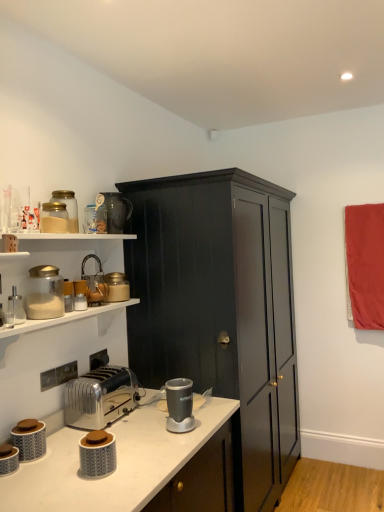
What do you see at coordinates (220, 309) in the screenshot? The width and height of the screenshot is (384, 512). I see `dark wood cabinet at center` at bounding box center [220, 309].

How much space does matte gray jar at lower left, arranged as the ninth appliance when viewed from the top, occupy vertically?

5.60 inches.

You are a GUI agent. You are given a task and a screenshot of the screen. Output one action in this format:
    pyautogui.click(x=<x>, y=<y>)
    Task: Click on the matte gray jar at lower left, arranged as the ninth appliance when viewed from the top
    
    Given the screenshot: What is the action you would take?
    pyautogui.click(x=98, y=457)

Describe the element at coordinates (68, 296) in the screenshot. I see `metallic silver toaster at upper left, arranged as the 6th appliance when viewed from the top` at that location.

Identify the location of clear glass salt shaker at left, positioned as the 5th appliance in bottom-to-top order. (17, 306).

Identify the location of dark wood cabinet at center. This screenshot has width=384, height=512. (220, 309).

From a real-world perspective, is metallic gray blender at center, the fourth appliance when ordered from bottom to top, on matte glass jar at upper left, the 1th appliance positioned from the top?

No, from a real-world perspective, metallic gray blender at center, the fourth appliance when ordered from bottom to top, is not over matte glass jar at upper left, the 1th appliance positioned from the top

Which object is positioned more to the left, metallic gray blender at center, which appears as the 8th appliance when viewed from the top, or matte glass jar at upper left, the 1th appliance positioned from the top?

From the viewer's perspective, matte glass jar at upper left, the 1th appliance positioned from the top, appears more on the left side.

Is metallic gray blender at center, which appears as the 8th appliance when viewed from the top, situated inside matte glass jar at upper left, the 1th appliance positioned from the top, or outside?

metallic gray blender at center, which appears as the 8th appliance when viewed from the top, is not inside matte glass jar at upper left, the 1th appliance positioned from the top, it's outside.

Is metallic gray blender at center, the fourth appliance when ordered from bottom to top, positioned with its back to matte glass jar at upper left, the 11th appliance ordered from the bottom?

metallic gray blender at center, the fourth appliance when ordered from bottom to top, does not have its back to matte glass jar at upper left, the 11th appliance ordered from the bottom.

Considering the relative sizes of matte gray canister at lower left, the 11th appliance when ordered from top to bottom, and matte glass jar at upper left, the eighth appliance from the bottom, in the image provided, is matte gray canister at lower left, the 11th appliance when ordered from top to bottom, shorter than matte glass jar at upper left, the eighth appliance from the bottom,?

Yes.

Are matte gray canister at lower left, the 11th appliance when ordered from top to bottom, and matte glass jar at upper left, the eighth appliance from the bottom, beside each other?

There is a gap between matte gray canister at lower left, the 11th appliance when ordered from top to bottom, and matte glass jar at upper left, the eighth appliance from the bottom.

Between matte gray canister at lower left, the 11th appliance when ordered from top to bottom, and matte glass jar at upper left, the eighth appliance from the bottom, which one has smaller size?

Smaller between the two is matte gray canister at lower left, the 11th appliance when ordered from top to bottom.

Does point (10, 461) appear closer or farther from the camera than point (28, 281)?

Clearly, point (10, 461) is closer to the camera than point (28, 281).

Is matte glass jar at upper left, the 11th appliance ordered from the bottom, at the back of matte glass jar at upper left, positioned as the second appliance in top-to-bottom order?

No, matte glass jar at upper left, positioned as the second appliance in top-to-bottom order, is not facing the opposite direction of matte glass jar at upper left, the 11th appliance ordered from the bottom.

Based on the photo, from a real-world perspective, who is located lower, matte glass jar at upper left, arranged as the tenth appliance when ordered from the bottom, or matte glass jar at upper left, the 1th appliance positioned from the top?

matte glass jar at upper left, arranged as the tenth appliance when ordered from the bottom, is physically lower.

Consider the image. Is matte glass jar at upper left, positioned as the second appliance in top-to-bottom order, in front of matte glass jar at upper left, the 1th appliance positioned from the top?

Yes, matte glass jar at upper left, positioned as the second appliance in top-to-bottom order, is closer to the camera.

Is matte gray jar at lower left, which is the 3th appliance from bottom to top, shorter than metallic silver toaster at upper left, arranged as the 6th appliance when viewed from the top?

Indeed, matte gray jar at lower left, which is the 3th appliance from bottom to top, has a lesser height compared to metallic silver toaster at upper left, arranged as the 6th appliance when viewed from the top.

From the picture: Is the position of matte gray jar at lower left, arranged as the ninth appliance when viewed from the top, more distant than that of metallic silver toaster at upper left, arranged as the sixth appliance when ordered from the bottom?

No, it is in front of metallic silver toaster at upper left, arranged as the sixth appliance when ordered from the bottom.

Is matte gray jar at lower left, which is the 3th appliance from bottom to top, facing towards metallic silver toaster at upper left, arranged as the sixth appliance when ordered from the bottom?

No, matte gray jar at lower left, which is the 3th appliance from bottom to top, is not facing towards metallic silver toaster at upper left, arranged as the sixth appliance when ordered from the bottom.

Would you say matte gray jar at lower left, arranged as the ninth appliance when viewed from the top, is to the left or to the right of metallic silver toaster at upper left, arranged as the 6th appliance when viewed from the top, in the picture?

Based on their positions, matte gray jar at lower left, arranged as the ninth appliance when viewed from the top, is located to the right of metallic silver toaster at upper left, arranged as the 6th appliance when viewed from the top.

Is metallic faucet at upper left, the third appliance viewed from the top, positioned beyond the bounds of dark wood cabinet at center?

Indeed, metallic faucet at upper left, the third appliance viewed from the top, is completely outside dark wood cabinet at center.

Could you measure the distance between metallic faucet at upper left, the third appliance viewed from the top, and dark wood cabinet at center?

The distance of metallic faucet at upper left, the third appliance viewed from the top, from dark wood cabinet at center is 28.31 inches.

In terms of width, does metallic faucet at upper left, the third appliance viewed from the top, look wider or thinner when compared to dark wood cabinet at center?

Clearly, metallic faucet at upper left, the third appliance viewed from the top, has less width compared to dark wood cabinet at center.

Is matte gray jar at lower left, which is the 3th appliance from bottom to top, to the left of matte glass jar at upper left, the 4th appliance from the top, from the viewer's perspective?

In fact, matte gray jar at lower left, which is the 3th appliance from bottom to top, is to the right of matte glass jar at upper left, the 4th appliance from the top.

Between matte gray jar at lower left, arranged as the ninth appliance when viewed from the top, and matte glass jar at upper left, the eighth appliance from the bottom, which one has more height?

With more height is matte glass jar at upper left, the eighth appliance from the bottom.

Considering the relative sizes of matte gray jar at lower left, arranged as the ninth appliance when viewed from the top, and matte glass jar at upper left, the eighth appliance from the bottom, in the image provided, is matte gray jar at lower left, arranged as the ninth appliance when viewed from the top, thinner than matte glass jar at upper left, the eighth appliance from the bottom,?

Correct, the width of matte gray jar at lower left, arranged as the ninth appliance when viewed from the top, is less than that of matte glass jar at upper left, the eighth appliance from the bottom.

Does clear glass salt shaker at left, the 7th appliance when ordered from top to bottom, have a lesser height compared to red fabric curtain at right?

Correct, clear glass salt shaker at left, the 7th appliance when ordered from top to bottom, is not as tall as red fabric curtain at right.

Looking at this image, can you confirm if clear glass salt shaker at left, positioned as the 5th appliance in bottom-to-top order, is positioned to the right of red fabric curtain at right?

No, clear glass salt shaker at left, positioned as the 5th appliance in bottom-to-top order, is not to the right of red fabric curtain at right.

Is clear glass salt shaker at left, the 7th appliance when ordered from top to bottom, oriented away from red fabric curtain at right?

clear glass salt shaker at left, the 7th appliance when ordered from top to bottom, is not turned away from red fabric curtain at right.

Between clear glass salt shaker at left, the 7th appliance when ordered from top to bottom, and red fabric curtain at right, which one is positioned behind?

red fabric curtain at right is further from the camera.

Where is `the 3rd appliance in front of the matte glass jar at upper left, the 11th appliance ordered from the bottom`? the 3rd appliance in front of the matte glass jar at upper left, the 11th appliance ordered from the bottom is located at coordinates (179, 405).

The width and height of the screenshot is (384, 512). There is a matte gray canister at lower left, which ranks as the 1th appliance in bottom-to-top order. What are the coordinates of `the 7th appliance above it (from a real-world perspective)` in the screenshot? It's located at (45, 293).

When comparing their distances from matte gray canister at lower left, arranged as the 2th appliance when ordered from the bottom, does red fabric curtain at right or matte glass jar at upper left, placed as the seventh appliance when sorted from bottom to top, seem closer?

Based on the image, matte glass jar at upper left, placed as the seventh appliance when sorted from bottom to top, appears to be nearer to matte gray canister at lower left, arranged as the 2th appliance when ordered from the bottom.

Based on their spatial positions, is matte glass jar at upper left, positioned as the 5th appliance in top-to-bottom order, or matte glass jar at upper left, the 4th appliance from the top, closer to dark wood cabinet at center?

matte glass jar at upper left, positioned as the 5th appliance in top-to-bottom order, lies closer to dark wood cabinet at center than the other object.

Based on their spatial positions, is matte gray canister at lower left, arranged as the 2th appliance when ordered from the bottom, or matte glass jar at upper left, positioned as the 5th appliance in top-to-bottom order, closer to matte gray canister at lower left, the 11th appliance when ordered from top to bottom?

matte gray canister at lower left, arranged as the 2th appliance when ordered from the bottom, is closer to matte gray canister at lower left, the 11th appliance when ordered from top to bottom.

Looking at the image, which one is located further to metallic faucet at upper left, the third appliance viewed from the top, dark wood cabinet at center or metallic silver toaster at upper left, arranged as the 6th appliance when viewed from the top?

dark wood cabinet at center lies further to metallic faucet at upper left, the third appliance viewed from the top, than the other object.

When comparing their distances from matte glass jar at upper left, the 4th appliance from the top, does matte gray canister at lower left, the 10th appliance when ordered from top to bottom, or matte gray canister at lower left, which ranks as the 1th appliance in bottom-to-top order, seem closer?

The object closer to matte glass jar at upper left, the 4th appliance from the top, is matte gray canister at lower left, the 10th appliance when ordered from top to bottom.

From the image, which object appears to be nearer to red fabric curtain at right, matte glass jar at upper left, positioned as the second appliance in top-to-bottom order, or dark wood cabinet at center?

dark wood cabinet at center is positioned closer to the anchor red fabric curtain at right.

When comparing their distances from white plastic toaster at lower left, does metallic gray blender at center, the fourth appliance when ordered from bottom to top, or matte glass jar at upper left, the eighth appliance from the bottom, seem further?

Among the two, matte glass jar at upper left, the eighth appliance from the bottom, is located further to white plastic toaster at lower left.

Looking at this image, estimate the real-world distances between objects in this image. Which object is closer to red fabric curtain at right, clear glass salt shaker at left, positioned as the 5th appliance in bottom-to-top order, or metallic silver toaster at upper left, arranged as the sixth appliance when ordered from the bottom?

metallic silver toaster at upper left, arranged as the sixth appliance when ordered from the bottom, lies closer to red fabric curtain at right than the other object.

Where is `cabinetry between metallic silver toaster at upper left, arranged as the sixth appliance when ordered from the bottom, and red fabric curtain at right`? The image size is (384, 512). cabinetry between metallic silver toaster at upper left, arranged as the sixth appliance when ordered from the bottom, and red fabric curtain at right is located at coordinates (220, 309).

Where is `toaster between metallic faucet at upper left, the third appliance viewed from the top, and dark wood cabinet at center from left to right`? The image size is (384, 512). toaster between metallic faucet at upper left, the third appliance viewed from the top, and dark wood cabinet at center from left to right is located at coordinates (101, 397).

The image size is (384, 512). What are the coordinates of `toaster that lies between matte glass jar at upper left, the 11th appliance ordered from the bottom, and matte gray canister at lower left, which ranks as the 1th appliance in bottom-to-top order, from top to bottom` in the screenshot? It's located at (101, 397).

You are a GUI agent. You are given a task and a screenshot of the screen. Output one action in this format:
    pyautogui.click(x=<x>, y=<y>)
    Task: Click on the toaster between matte glass jar at upper left, placed as the seventh appliance when sorted from bottom to top, and matte gray canister at lower left, arranged as the 2th appliance when ordered from the bottom, in the up-down direction
    Image resolution: width=384 pixels, height=512 pixels.
    Given the screenshot: What is the action you would take?
    pyautogui.click(x=101, y=397)